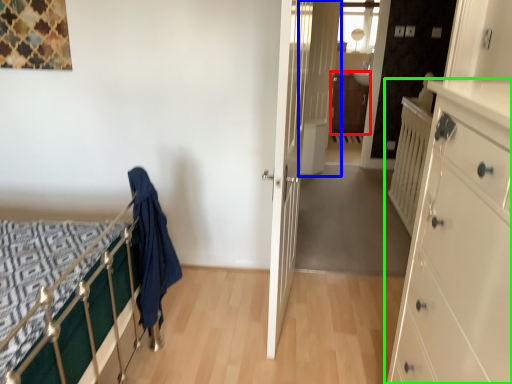
Question: Based on their relative distances, which object is nearer to file cabinet (highlighted by a red box)? Choose from door (highlighted by a blue box) and chest of drawers (highlighted by a green box).

Choices:
 (A) door
 (B) chest of drawers

Answer: (A)